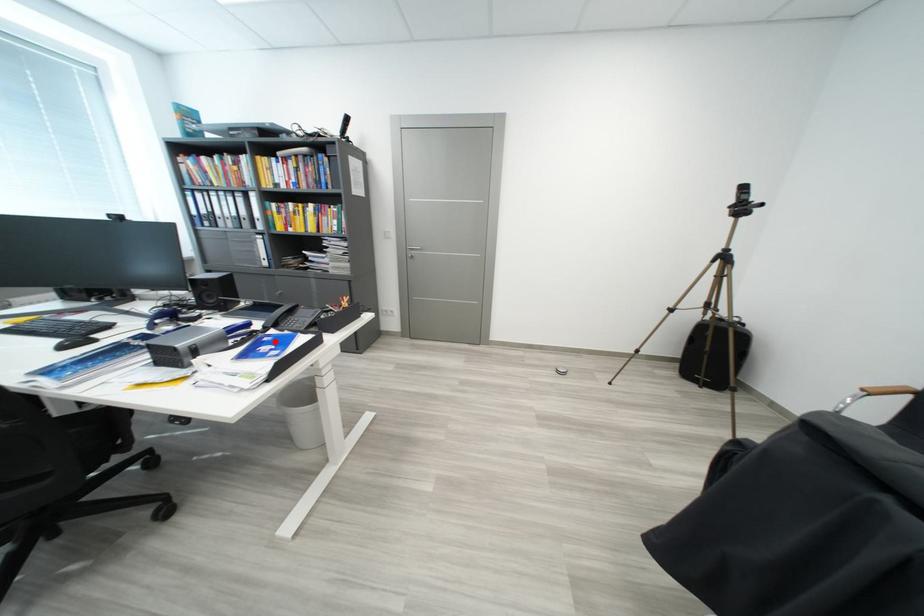
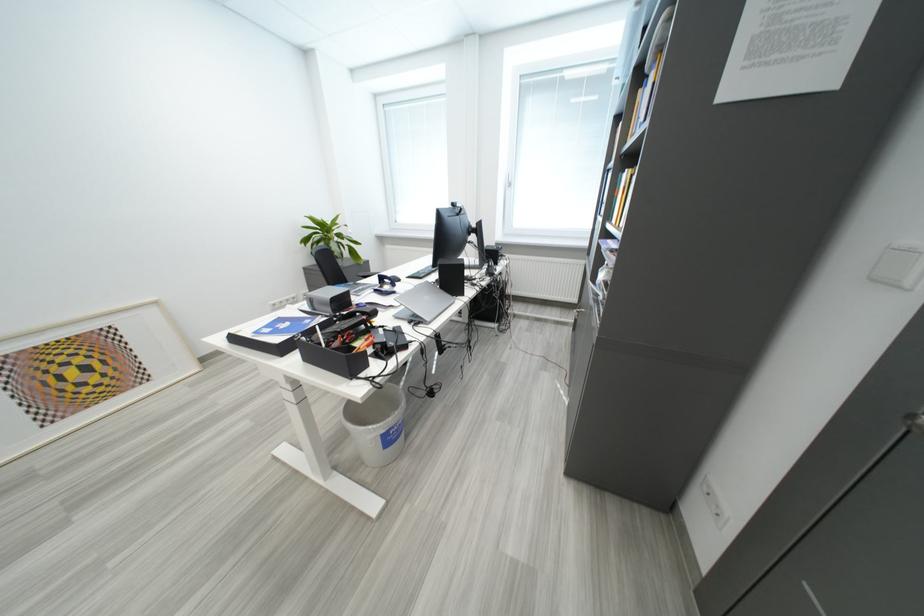
Find the pixel in the second image that matches the highlighted location in the first image.

(317, 323)